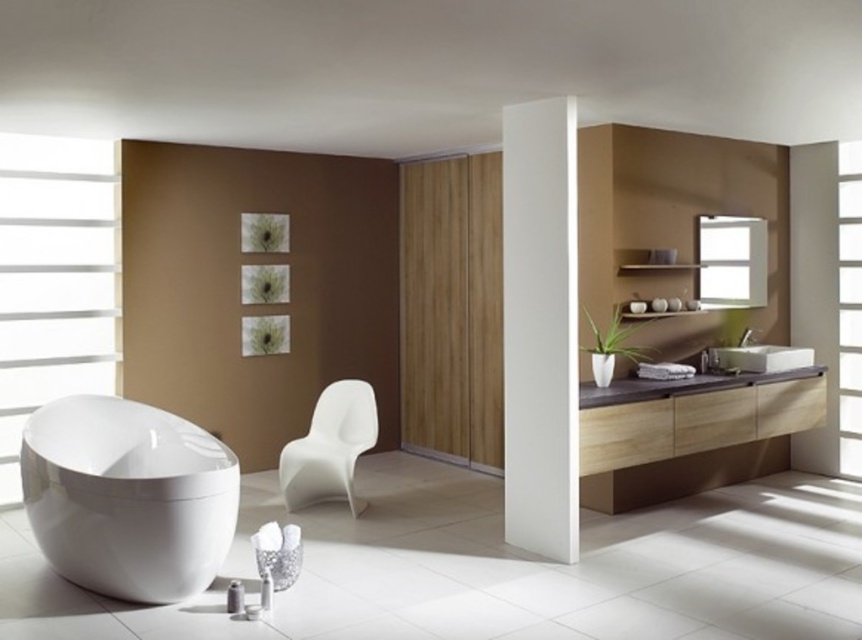
Question: Which object is farther from the camera taking this photo?

Choices:
 (A) white glossy sink at right
 (B) transparent glass door at right
 (C) white matte chair at center

Answer: (B)

Question: Does light wood vanity at right have a lesser width compared to transparent glass window at upper right?

Choices:
 (A) no
 (B) yes

Answer: (A)

Question: Can you confirm if white matte window at left is smaller than white glossy sink at right?

Choices:
 (A) no
 (B) yes

Answer: (A)

Question: Which is nearer to the white glossy bathtub at lower left?

Choices:
 (A) white matte window at left
 (B) transparent glass door at right
 (C) white glossy pillar at center
 (D) white matte chair at center

Answer: (D)

Question: Based on their relative distances, which object is nearer to the transparent glass door at right?

Choices:
 (A) white glossy bathtub at lower left
 (B) light wood vanity at right
 (C) white matte chair at center
 (D) white matte window at left

Answer: (B)

Question: Can you confirm if white glossy pillar at center is positioned below white glossy sink at right?

Choices:
 (A) no
 (B) yes

Answer: (A)